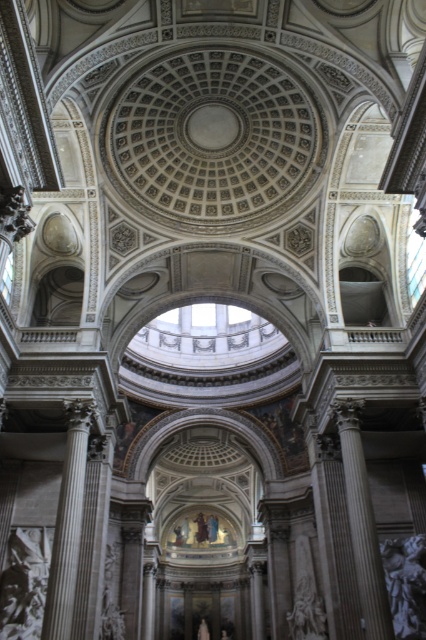
You are an architect assessing the structural integrity of the columns in the cathedral. Given that the white marble column at left is thinner than the gray marble column at right, which column might be more prone to buckling under heavy loads?

The white marble column at left is thinner than the gray marble column at right, so it might be more prone to buckling under heavy loads due to its smaller diameter providing less stability.

You are standing at the entrance of the cathedral and notice the white marble column at left and the gray marble column at right. Which column is positioned higher from the ground?

The white marble column at left is positioned higher from the ground than the gray marble column at right.